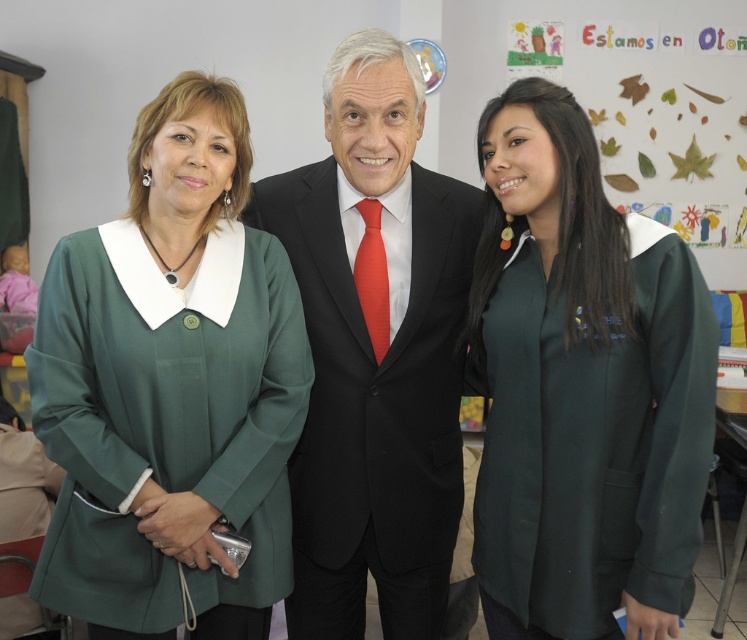
Which is behind, point (288, 442) or point (613, 147)?

The point (613, 147) is behind.

This screenshot has width=747, height=640. What are the coordinates of `green fabric coat at left` in the screenshot? It's located at (170, 387).

Can you confirm if black matte suit at center is smaller than green paper leaves at upper right?

Yes.

Is black matte suit at center in front of green paper leaves at upper right?

Yes, black matte suit at center is in front of green paper leaves at upper right.

Between point (446, 182) and point (560, 52), which one is positioned behind?

Positioned behind is point (560, 52).

Where is `black matte suit at center`? This screenshot has width=747, height=640. black matte suit at center is located at coordinates (374, 352).

The width and height of the screenshot is (747, 640). Describe the element at coordinates (582, 388) in the screenshot. I see `green fabric shirt at center` at that location.

From the picture: Is green fabric shirt at center closer to camera compared to black matte suit at center?

Yes, it is.

Which is behind, point (521, 292) or point (329, 300)?

The point (329, 300) is more distant.

The width and height of the screenshot is (747, 640). I want to click on green fabric shirt at center, so click(x=582, y=388).